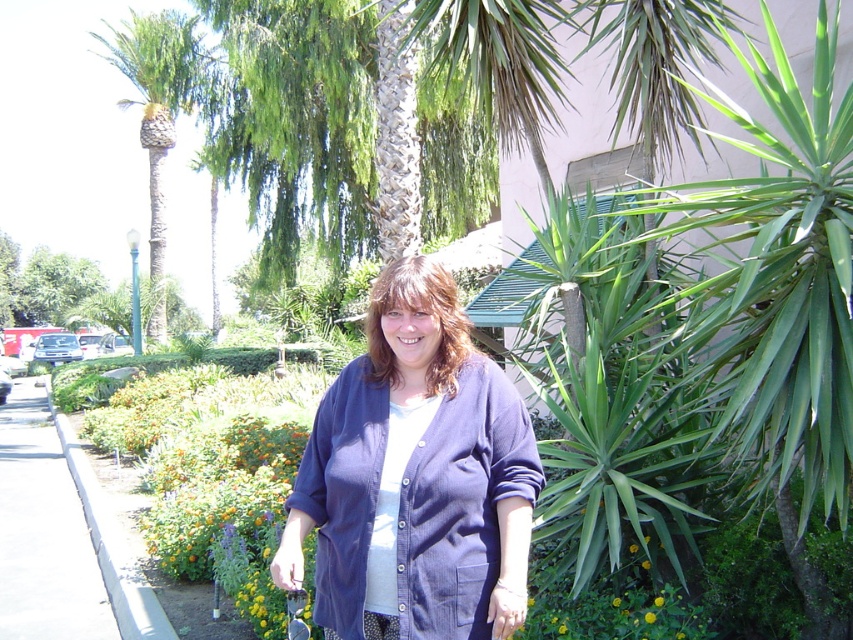
Is blue corduroy cardigan at center closer to the viewer compared to gray concrete sidewalk at lower left?

Yes, blue corduroy cardigan at center is closer to the viewer.

Between blue corduroy cardigan at center and gray concrete sidewalk at lower left, which one has more height?

With more height is blue corduroy cardigan at center.

Where is `blue corduroy cardigan at center`? blue corduroy cardigan at center is located at coordinates (415, 477).

Does point (38, 561) come behind point (134, 74)?

No, (38, 561) is in front of (134, 74).

Who is more distant from viewer, (13, 456) or (202, 67)?

Positioned behind is point (202, 67).

I want to click on gray concrete sidewalk at lower left, so click(x=44, y=532).

Does blue corduroy cardigan at center appear over green leafy palm tree at left?

Actually, blue corduroy cardigan at center is below green leafy palm tree at left.

Can you confirm if blue corduroy cardigan at center is bigger than green leafy palm tree at left?

No.

Is point (366, 600) positioned before point (164, 193)?

Yes, point (366, 600) is closer to viewer.

The image size is (853, 640). Identify the location of blue corduroy cardigan at center. (415, 477).